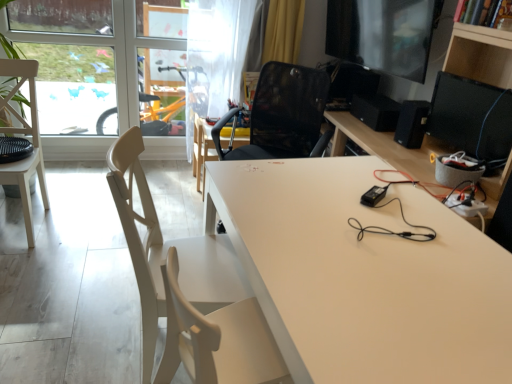
Question: Considering their positions, is white wood chair at left, the 2th chair from the right, located in front of or behind black glossy monitor at upper right, the first computer monitor when ordered from bottom to top?

Choices:
 (A) front
 (B) behind

Answer: (B)

Question: In terms of width, does white wood chair at left, positioned as the 2th chair in front-to-back order, look wider or thinner when compared to black glossy monitor at upper right, the 2th computer monitor from the top?

Choices:
 (A) thin
 (B) wide

Answer: (B)

Question: Which object is the farthest from the transparent glass window at upper left?

Choices:
 (A) black matte speaker at upper right, which is the first speaker in back-to-front order
 (B) white wood chair at left, positioned as the 2th chair in front-to-back order
 (C) white wood chair at left, acting as the 1th chair starting from the right
 (D) black matte speaker at right, positioned as the 1th speaker in front-to-back order
 (E) white matte table at center, the second table when ordered from bottom to top

Answer: (D)

Question: Estimate the real-world distances between objects in this image. Which object is farther from the black matte speaker at upper right, the second speaker in the front-to-back sequence?

Choices:
 (A) white wood chair at left, acting as the second chair starting from the back
 (B) white matte table at center, the second table positioned from the right
 (C) matte black monitor at upper right, the second computer monitor positioned from the bottom
 (D) white matte table at center, the 1th table viewed from the right
 (E) white wood chair at left, the first chair positioned from the left

Answer: (E)